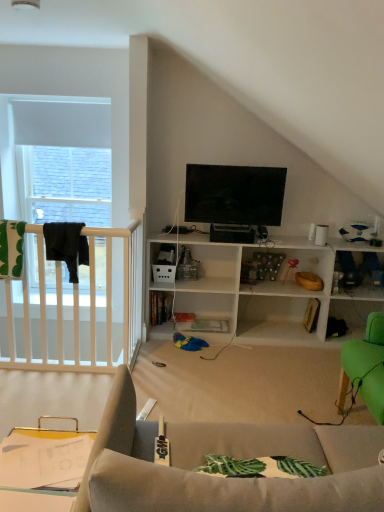
Question: Considering the relative sizes of flat screen tv at upper center and clear plastic tray at lower left in the image provided, is flat screen tv at upper center bigger than clear plastic tray at lower left?

Choices:
 (A) yes
 (B) no

Answer: (A)

Question: Considering the relative sizes of flat screen tv at upper center and clear plastic tray at lower left in the image provided, is flat screen tv at upper center shorter than clear plastic tray at lower left?

Choices:
 (A) yes
 (B) no

Answer: (B)

Question: Does flat screen tv at upper center have a smaller size compared to clear plastic tray at lower left?

Choices:
 (A) yes
 (B) no

Answer: (B)

Question: Does flat screen tv at upper center turn towards clear plastic tray at lower left?

Choices:
 (A) yes
 (B) no

Answer: (B)

Question: From a real-world perspective, is flat screen tv at upper center positioned over clear plastic tray at lower left based on gravity?

Choices:
 (A) no
 (B) yes

Answer: (B)

Question: Is flat screen tv at upper center positioned beyond the bounds of clear plastic tray at lower left?

Choices:
 (A) no
 (B) yes

Answer: (B)

Question: Is flat screen tv at upper center bigger than black fabric at left?

Choices:
 (A) yes
 (B) no

Answer: (A)

Question: Is flat screen tv at upper center positioned far away from black fabric at left?

Choices:
 (A) yes
 (B) no

Answer: (A)

Question: From the image's perspective, is flat screen tv at upper center located beneath black fabric at left?

Choices:
 (A) no
 (B) yes

Answer: (A)

Question: Is flat screen tv at upper center next to black fabric at left and touching it?

Choices:
 (A) no
 (B) yes

Answer: (A)

Question: Is flat screen tv at upper center smaller than black fabric at left?

Choices:
 (A) yes
 (B) no

Answer: (B)

Question: Is the depth of flat screen tv at upper center greater than that of black fabric at left?

Choices:
 (A) yes
 (B) no

Answer: (A)

Question: Is clear plastic tray at lower left facing away from black fabric at left?

Choices:
 (A) yes
 (B) no

Answer: (B)